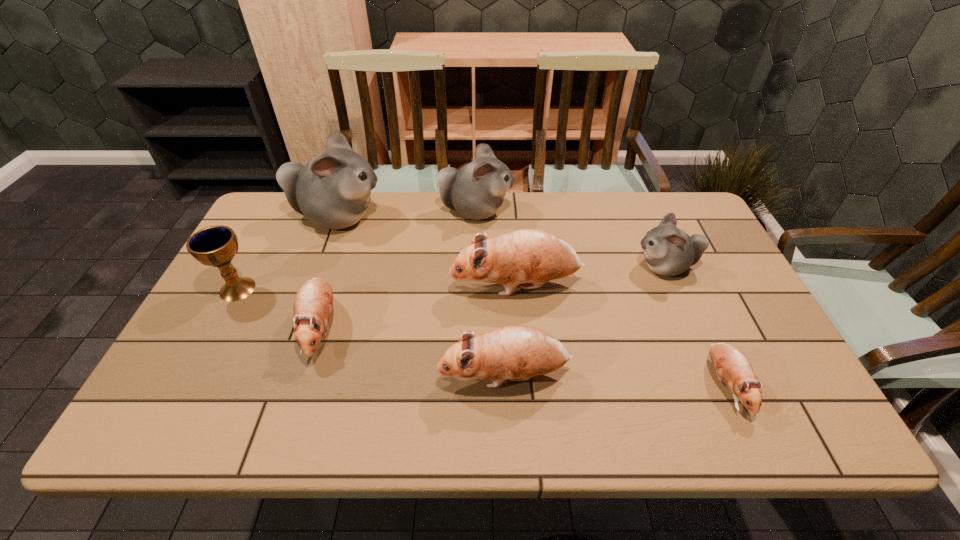
The height and width of the screenshot is (540, 960). Identify the location of free point between the second white hamster from left to right and the second biggest brown hamster. (491, 294).

Where is `object that is the closest to the second shortest object`? This screenshot has height=540, width=960. object that is the closest to the second shortest object is located at coordinates (216, 246).

You are a GUI agent. You are given a task and a screenshot of the screen. Output one action in this format:
    pyautogui.click(x=<x>, y=<y>)
    Task: Click on the object that ranks as the third closest to the biggest brown hamster
    
    Given the screenshot: What is the action you would take?
    pyautogui.click(x=477, y=190)

Identify the location of hamster that is the third closest one to the smallest brown hamster. This screenshot has width=960, height=540. (517, 353).

Locate an element on the screen. This screenshot has width=960, height=540. hamster that is the seventh closest to the chalice is located at coordinates (731, 365).

Point out which white hamster is positioned as the nearest to the second shortest object. Please provide its 2D coordinates. Your answer should be formatted as a tuple, i.e. [(x, y)], where the tuple contains the x and y coordinates of a point satisfying the conditions above.

[(333, 190)]

Locate which white hamster ranks third in proximity to the biggest brown hamster. Please provide its 2D coordinates. Your answer should be formatted as a tuple, i.e. [(x, y)], where the tuple contains the x and y coordinates of a point satisfying the conditions above.

[(333, 190)]

What are the coordinates of `brown hamster that stands as the fourth closest to the nearest white hamster` in the screenshot? It's located at (313, 302).

I want to click on the closest brown hamster to the leftmost brown hamster, so click(517, 353).

In order to click on free space that satisfies the following two spatial constraints: 1. on the face of the second white hamster from left to right; 2. at the face of the sixth tallest hamster in this screenshot , I will do `click(473, 328)`.